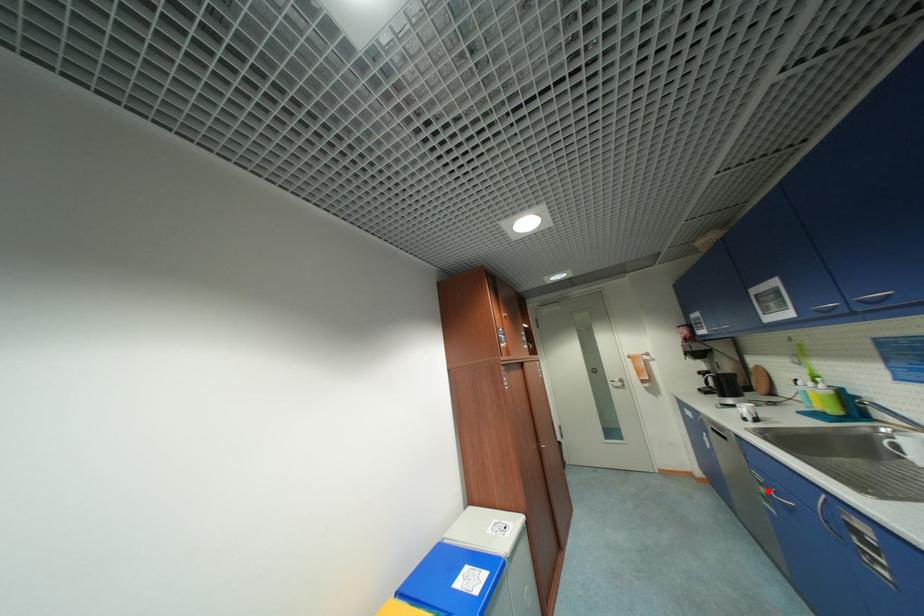
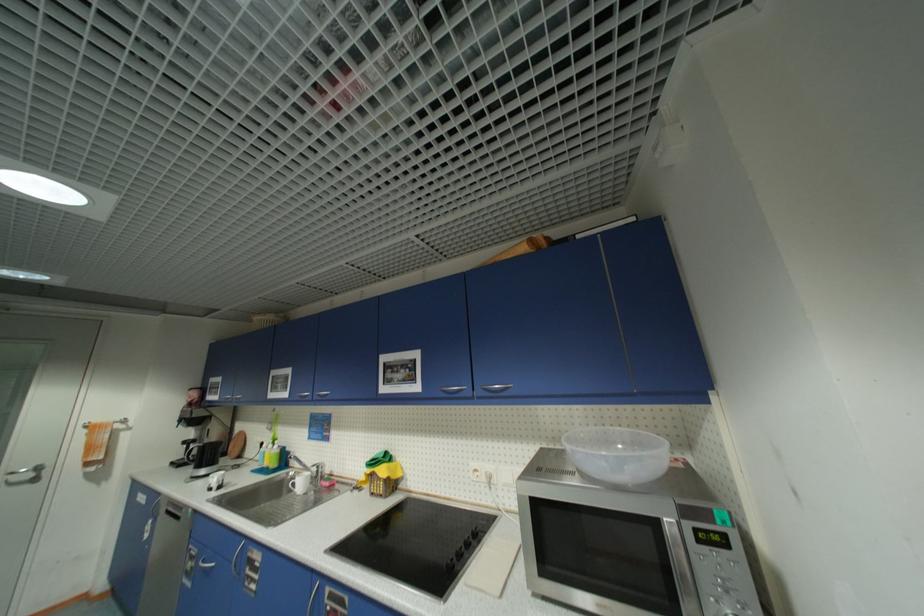
Question: I am providing you with two images of the same scene from different viewpoints. A red point is shown in image1. For the corresponding object point in image2, is it positioned nearer or farther from the camera?

Choices:
 (A) Nearer
 (B) Farther

Answer: (A)